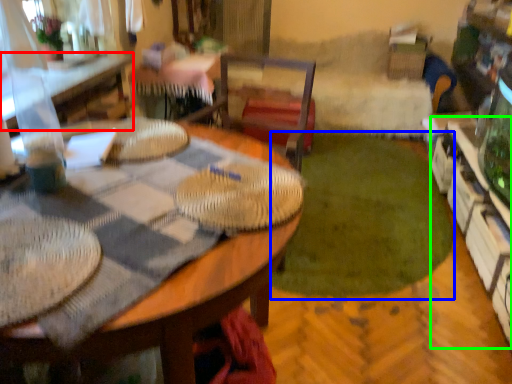
Question: Which object is the farthest from table (highlighted by a red box)? Choose among these: grass (highlighted by a blue box) or shelf (highlighted by a green box).

Choices:
 (A) grass
 (B) shelf

Answer: (B)